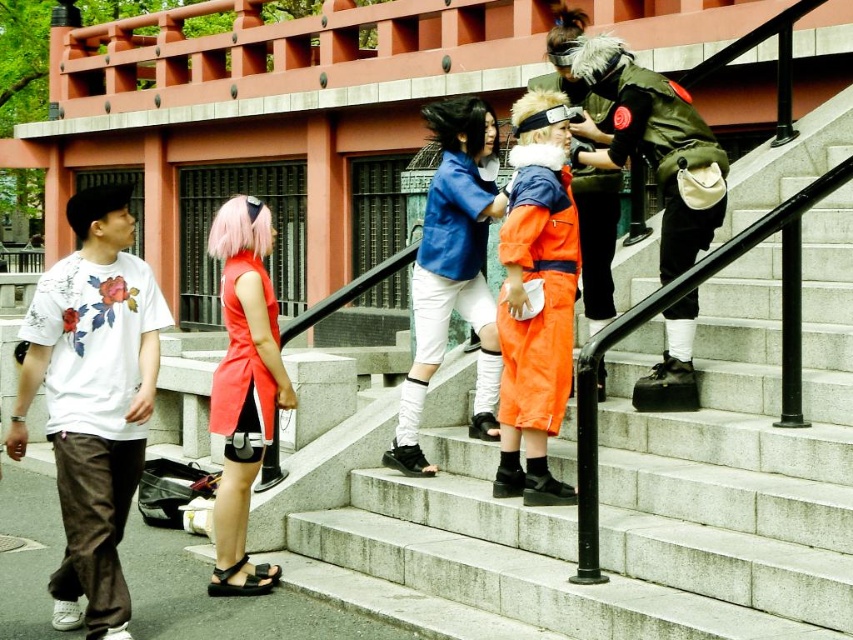
Does green fabric jacket at upper right have a larger size compared to blue fabric jacket at center?

Yes, green fabric jacket at upper right is bigger than blue fabric jacket at center.

Does green fabric jacket at upper right come behind blue fabric jacket at center?

No, it is not.

Is point (691, 381) positioned after point (489, 365)?

No.

At what (x,y) coordinates should I click in order to perform the action: click on green fabric jacket at upper right. Please return your answer as a coordinate pair (x, y). Looking at the image, I should click on (643, 134).

Is blue fabric jacket at center to the left of vivid orange fabric dress at center from the viewer's perspective?

Incorrect, blue fabric jacket at center is not on the left side of vivid orange fabric dress at center.

Which is behind, point (480, 376) or point (231, 490)?

Positioned behind is point (480, 376).

Does point (444, 211) lie behind point (267, 240)?

Yes, point (444, 211) is farther from viewer.

You are a GUI agent. You are given a task and a screenshot of the screen. Output one action in this format:
    pyautogui.click(x=<x>, y=<y>)
    Task: Click on the blue fabric jacket at center
    The width and height of the screenshot is (853, 640).
    Given the screenshot: What is the action you would take?
    pyautogui.click(x=453, y=272)

Is point (85, 611) more distant than point (225, 317)?

No.

Does white cotton t-shirt at left have a lesser height compared to vivid orange fabric dress at center?

Correct, white cotton t-shirt at left is not as tall as vivid orange fabric dress at center.

The image size is (853, 640). What do you see at coordinates (93, 400) in the screenshot? I see `white cotton t-shirt at left` at bounding box center [93, 400].

In order to click on white cotton t-shirt at left in this screenshot , I will do `click(93, 400)`.